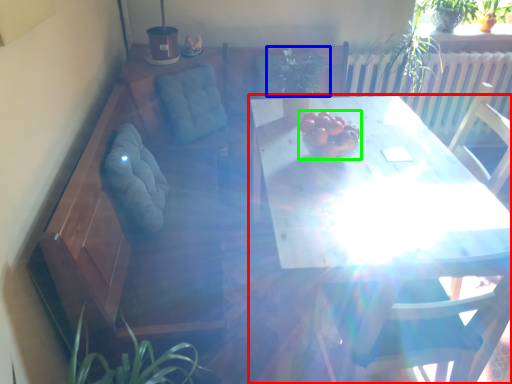
Question: Estimate the real-world distances between objects in this image. Which object is farther from table (highlighted by a red box), plant (highlighted by a blue box) or fruit (highlighted by a green box)?

Choices:
 (A) plant
 (B) fruit

Answer: (A)